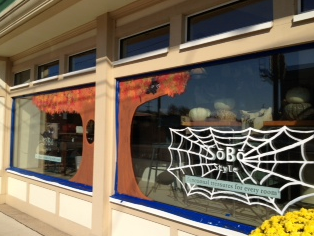
Where is `tree window decoration`? The width and height of the screenshot is (314, 236). tree window decoration is located at coordinates (85, 108), (123, 108).